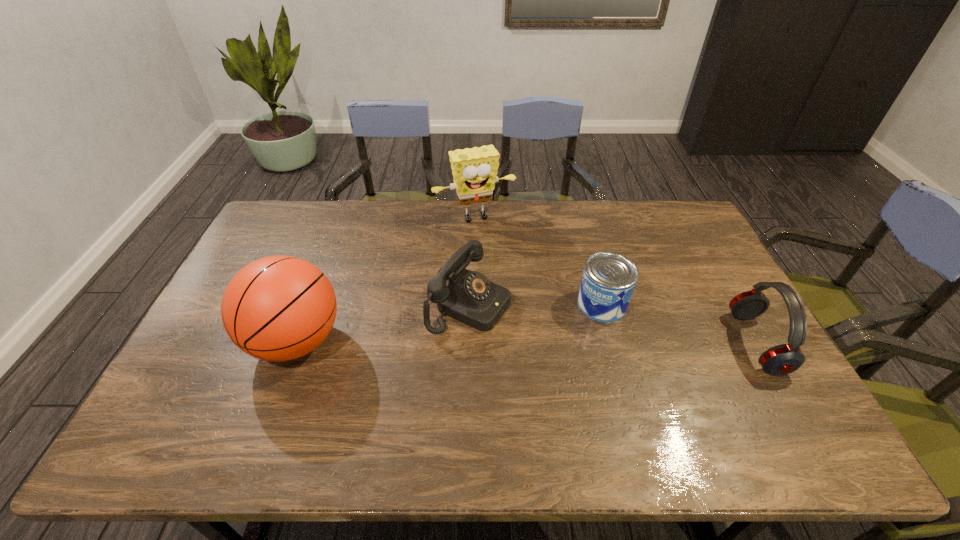
Locate an element on the screen. The image size is (960, 540). free spot that satisfies the following two spatial constraints: 1. on the front side of the can; 2. on the left side of the telephone is located at coordinates (469, 304).

Where is `free spot that satisfies the following two spatial constraints: 1. on the front side of the rightmost object; 2. on the ear cups of the fourth object from left to right`? The image size is (960, 540). free spot that satisfies the following two spatial constraints: 1. on the front side of the rightmost object; 2. on the ear cups of the fourth object from left to right is located at coordinates (612, 343).

You are a GUI agent. You are given a task and a screenshot of the screen. Output one action in this format:
    pyautogui.click(x=<x>, y=<y>)
    Task: Click on the vacant position in the image that satisfies the following two spatial constraints: 1. on the front side of the earphone; 2. on the ear cups of the telephone
    Image resolution: width=960 pixels, height=540 pixels.
    Given the screenshot: What is the action you would take?
    pyautogui.click(x=468, y=343)